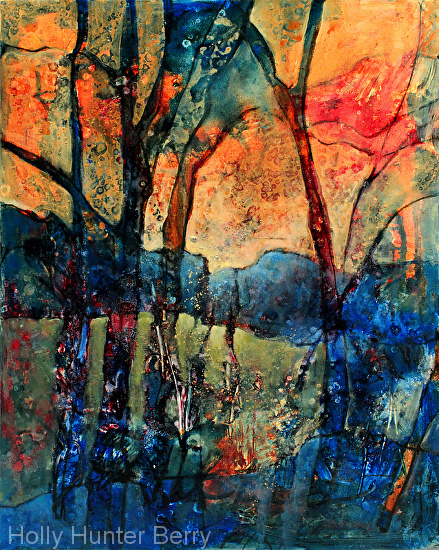
This screenshot has height=550, width=439. I want to click on artwork, so click(253, 301).